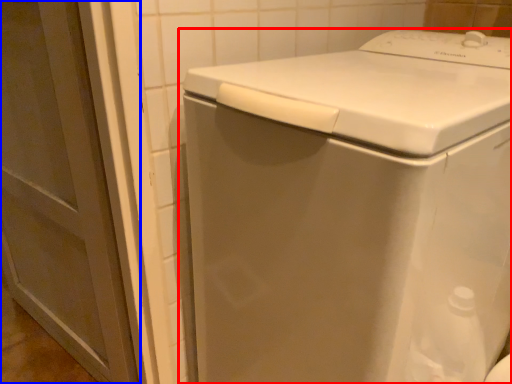
Question: Which point is closer to the camera, washing machine (highlighted by a red box) or screen door (highlighted by a blue box)?

Choices:
 (A) washing machine
 (B) screen door

Answer: (A)